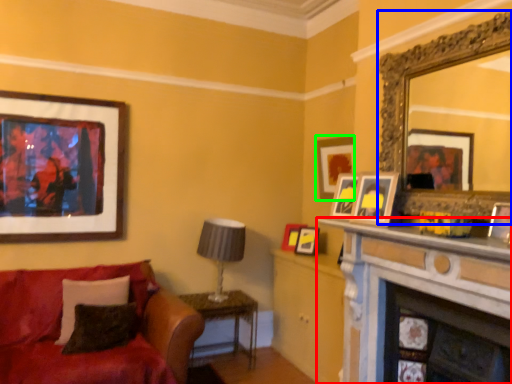
Question: Considering the real-world distances, which object is farthest from fireplace (highlighted by a red box)? mirror (highlighted by a blue box) or picture frame (highlighted by a green box)?

Choices:
 (A) mirror
 (B) picture frame

Answer: (B)